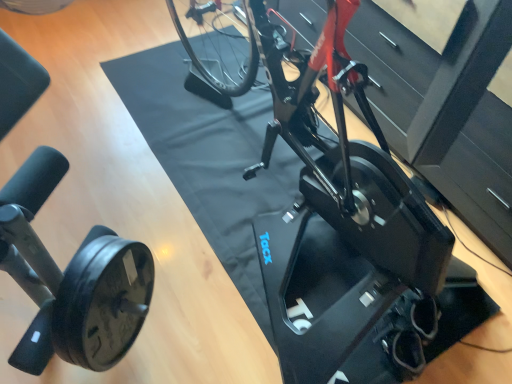
Describe the element at coordinates (102, 302) in the screenshot. I see `black rubber wheel at lower left` at that location.

At what (x,y) coordinates should I click in order to perform the action: click on black rubber wheel at lower left. Please return your answer as a coordinate pair (x, y). Image resolution: width=512 pixels, height=384 pixels. Looking at the image, I should click on (102, 302).

Based on the photo, is black rubber stationary bicycle at lower left, which is the first stationary bicycle in left-to-right order, wider than black rubber wheel at lower left?

Indeed, black rubber stationary bicycle at lower left, which is the first stationary bicycle in left-to-right order, has a greater width compared to black rubber wheel at lower left.

Would you say black rubber stationary bicycle at lower left, the 2th stationary bicycle when ordered from right to left, contains black rubber wheel at lower left?

Actually, black rubber wheel at lower left is outside black rubber stationary bicycle at lower left, the 2th stationary bicycle when ordered from right to left.

Which object is thinner, black rubber wheel at lower left or black rubber stationary bicycle at lower left, marked as the second stationary bicycle in a back-to-front arrangement?

black rubber wheel at lower left.

Is black rubber wheel at lower left in front of black rubber stationary bicycle at lower left, acting as the 1th stationary bicycle starting from the front?

Yes, black rubber wheel at lower left is closer to the camera.

Is black rubber wheel at lower left situated inside black rubber stationary bicycle at lower left, which is the first stationary bicycle in left-to-right order, or outside?

black rubber wheel at lower left is spatially situated outside black rubber stationary bicycle at lower left, which is the first stationary bicycle in left-to-right order.

Is black matte stationary bicycle at center, which is the first stationary bicycle in back-to-front order, bigger than black rubber wheel at lower left?

Correct, black matte stationary bicycle at center, which is the first stationary bicycle in back-to-front order, is larger in size than black rubber wheel at lower left.

Considering the positions of objects black matte stationary bicycle at center, which ranks as the second stationary bicycle in left-to-right order, and black rubber wheel at lower left in the image provided, who is more to the right, black matte stationary bicycle at center, which ranks as the second stationary bicycle in left-to-right order, or black rubber wheel at lower left?

From the viewer's perspective, black matte stationary bicycle at center, which ranks as the second stationary bicycle in left-to-right order, appears more on the right side.

From the image's perspective, is black matte stationary bicycle at center, which ranks as the second stationary bicycle in left-to-right order, under black rubber wheel at lower left?

No, from the image's perspective, black matte stationary bicycle at center, which ranks as the second stationary bicycle in left-to-right order, is not below black rubber wheel at lower left.

Is black matte stationary bicycle at center, marked as the 1th stationary bicycle in a right-to-left arrangement, further to the viewer compared to black rubber wheel at lower left?

Yes, it is behind black rubber wheel at lower left.

Considering the relative sizes of black matte stationary bicycle at center, which is the first stationary bicycle in back-to-front order, and black rubber stationary bicycle at lower left, marked as the second stationary bicycle in a back-to-front arrangement, in the image provided, is black matte stationary bicycle at center, which is the first stationary bicycle in back-to-front order, smaller than black rubber stationary bicycle at lower left, marked as the second stationary bicycle in a back-to-front arrangement,?

Incorrect, black matte stationary bicycle at center, which is the first stationary bicycle in back-to-front order, is not smaller in size than black rubber stationary bicycle at lower left, marked as the second stationary bicycle in a back-to-front arrangement.

Which of these two, black matte stationary bicycle at center, which is the first stationary bicycle in back-to-front order, or black rubber stationary bicycle at lower left, acting as the 1th stationary bicycle starting from the front, is thinner?

black rubber stationary bicycle at lower left, acting as the 1th stationary bicycle starting from the front, is thinner.

Is black matte stationary bicycle at center, which ranks as the second stationary bicycle in left-to-right order, in front of or behind black rubber stationary bicycle at lower left, marked as the second stationary bicycle in a back-to-front arrangement, in the image?

Clearly, black matte stationary bicycle at center, which ranks as the second stationary bicycle in left-to-right order, is behind black rubber stationary bicycle at lower left, marked as the second stationary bicycle in a back-to-front arrangement.

Does black rubber wheel at lower left lie behind black matte stationary bicycle at center, which is the first stationary bicycle in back-to-front order?

No, it is in front of black matte stationary bicycle at center, which is the first stationary bicycle in back-to-front order.

Measure the distance between black rubber wheel at lower left and black matte stationary bicycle at center, marked as the 1th stationary bicycle in a right-to-left arrangement.

A distance of 26.18 inches exists between black rubber wheel at lower left and black matte stationary bicycle at center, marked as the 1th stationary bicycle in a right-to-left arrangement.

Is black rubber wheel at lower left inside the boundaries of black matte stationary bicycle at center, the 2th stationary bicycle viewed from the front, or outside?

black rubber wheel at lower left is located beyond the bounds of black matte stationary bicycle at center, the 2th stationary bicycle viewed from the front.

From the image's perspective, count 2nd stationary bicycles upward from the black rubber wheel at lower left and point to it. Please provide its 2D coordinates.

[(351, 170)]

How much distance is there between black rubber stationary bicycle at lower left, marked as the second stationary bicycle in a back-to-front arrangement, and black matte stationary bicycle at center, marked as the 1th stationary bicycle in a right-to-left arrangement?

black rubber stationary bicycle at lower left, marked as the second stationary bicycle in a back-to-front arrangement, and black matte stationary bicycle at center, marked as the 1th stationary bicycle in a right-to-left arrangement, are 26.78 inches apart from each other.

Image resolution: width=512 pixels, height=384 pixels. Identify the location of stationary bicycle above the black matte stationary bicycle at center, marked as the 1th stationary bicycle in a right-to-left arrangement (from a real-world perspective). (71, 278).

Which is closer to the camera, [94,257] or [382,295]?

The point [94,257] is more forward.

From the image's perspective, which one is positioned higher, black rubber stationary bicycle at lower left, which is the first stationary bicycle in left-to-right order, or black matte stationary bicycle at center, marked as the 1th stationary bicycle in a right-to-left arrangement?

black matte stationary bicycle at center, marked as the 1th stationary bicycle in a right-to-left arrangement, appears higher in the image.

There is a black rubber wheel at lower left. Identify the location of the 1st stationary bicycle above it (from the image's perspective). The image size is (512, 384). (71, 278).

I want to click on wheel lying on the right of black rubber stationary bicycle at lower left, which is the first stationary bicycle in left-to-right order, so click(x=102, y=302).

From the image, which object appears to be farther from black matte stationary bicycle at center, which ranks as the second stationary bicycle in left-to-right order, black rubber wheel at lower left or black rubber stationary bicycle at lower left, acting as the 1th stationary bicycle starting from the front?

black rubber stationary bicycle at lower left, acting as the 1th stationary bicycle starting from the front, lies further to black matte stationary bicycle at center, which ranks as the second stationary bicycle in left-to-right order, than the other object.

Considering their positions, is black rubber stationary bicycle at lower left, marked as the second stationary bicycle in a back-to-front arrangement, positioned further to black matte stationary bicycle at center, the 2th stationary bicycle viewed from the front, than black rubber wheel at lower left?

Among the two, black rubber stationary bicycle at lower left, marked as the second stationary bicycle in a back-to-front arrangement, is located further to black matte stationary bicycle at center, the 2th stationary bicycle viewed from the front.

When comparing their distances from black rubber stationary bicycle at lower left, which is the first stationary bicycle in left-to-right order, does black matte stationary bicycle at center, the 2th stationary bicycle viewed from the front, or black rubber wheel at lower left seem closer?

black rubber wheel at lower left.

When comparing their distances from black rubber wheel at lower left, does black rubber stationary bicycle at lower left, acting as the 1th stationary bicycle starting from the front, or black matte stationary bicycle at center, marked as the 1th stationary bicycle in a right-to-left arrangement, seem closer?

black rubber stationary bicycle at lower left, acting as the 1th stationary bicycle starting from the front.

From the image, which object appears to be nearer to black rubber wheel at lower left, black matte stationary bicycle at center, marked as the 1th stationary bicycle in a right-to-left arrangement, or black rubber stationary bicycle at lower left, which is the first stationary bicycle in left-to-right order?

black rubber stationary bicycle at lower left, which is the first stationary bicycle in left-to-right order, is positioned closer to the anchor black rubber wheel at lower left.

Considering their positions, is black rubber wheel at lower left positioned further to black rubber stationary bicycle at lower left, marked as the second stationary bicycle in a back-to-front arrangement, than black matte stationary bicycle at center, which is the first stationary bicycle in back-to-front order?

black matte stationary bicycle at center, which is the first stationary bicycle in back-to-front order, lies further to black rubber stationary bicycle at lower left, marked as the second stationary bicycle in a back-to-front arrangement, than the other object.

Identify the location of stationary bicycle between black rubber wheel at lower left and black matte stationary bicycle at center, marked as the 1th stationary bicycle in a right-to-left arrangement, along the z-axis. (71, 278).